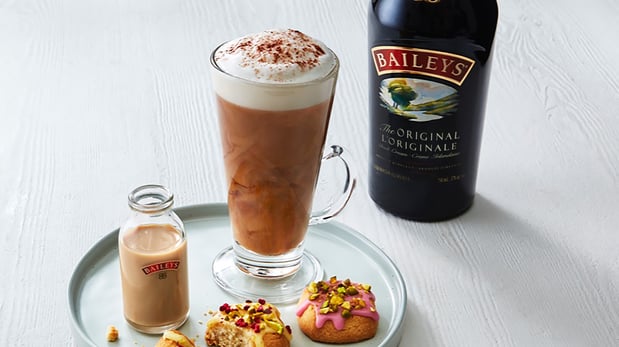
You are a GUI agent. You are given a task and a screenshot of the screen. Output one action in this format:
    pyautogui.click(x=<x>, y=<y>)
    Task: Click on the glass handle
    Image resolution: width=619 pixels, height=347 pixels.
    Given the screenshot: What is the action you would take?
    pyautogui.click(x=335, y=151)